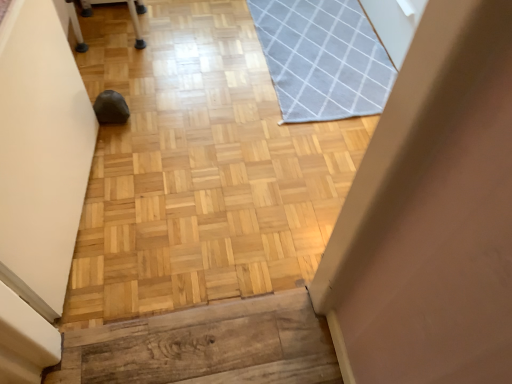
In order to face gray woven mat at upper right, should I rotate leftwards or rightwards?

It's best to rotate right around 9.405 degrees.

Measure the distance between point (265, 23) and camera.

A distance of 2.27 meters exists between point (265, 23) and camera.

Find the location of `gray woven mat at upper right`. gray woven mat at upper right is located at coordinates (322, 58).

What do you see at coordinates (322, 58) in the screenshot? This screenshot has width=512, height=384. I see `gray woven mat at upper right` at bounding box center [322, 58].

Identify the location of matte white plastic chair at upper left. (137, 20).

The height and width of the screenshot is (384, 512). Describe the element at coordinates (137, 20) in the screenshot. I see `matte white plastic chair at upper left` at that location.

You are a GUI agent. You are given a task and a screenshot of the screen. Output one action in this format:
    pyautogui.click(x=<x>, y=<y>)
    Task: Click on the gray woven mat at upper right
    This screenshot has height=384, width=512.
    Given the screenshot: What is the action you would take?
    pyautogui.click(x=322, y=58)

In the image, is matte white plastic chair at upper left on the left side or the right side of gray woven mat at upper right?

From the image, it's evident that matte white plastic chair at upper left is to the left of gray woven mat at upper right.

Considering their positions, is matte white plastic chair at upper left located in front of or behind gray woven mat at upper right?

matte white plastic chair at upper left is behind gray woven mat at upper right.

Which is in front, point (138, 44) or point (271, 36)?

Point (138, 44)

From the picture: From the image's perspective, is matte white plastic chair at upper left positioned above or below gray woven mat at upper right?

From the image's perspective, matte white plastic chair at upper left appears above gray woven mat at upper right.

From a real-world perspective, is matte white plastic chair at upper left physically located above or below gray woven mat at upper right?

From a real-world perspective, matte white plastic chair at upper left is physically above gray woven mat at upper right.

Is matte white plastic chair at upper left wider or thinner than gray woven mat at upper right?

Considering their sizes, matte white plastic chair at upper left looks slimmer than gray woven mat at upper right.

Considering the sizes of matte white plastic chair at upper left and gray woven mat at upper right in the image, is matte white plastic chair at upper left taller or shorter than gray woven mat at upper right?

Clearly, matte white plastic chair at upper left is taller compared to gray woven mat at upper right.

Based on their sizes in the image, would you say matte white plastic chair at upper left is bigger or smaller than gray woven mat at upper right?

Considering their sizes, matte white plastic chair at upper left takes up more space than gray woven mat at upper right.

Is matte white plastic chair at upper left inside the boundaries of gray woven mat at upper right, or outside?

The correct answer is: outside.

Is matte white plastic chair at upper left not close to gray woven mat at upper right?

No, matte white plastic chair at upper left is in close proximity to gray woven mat at upper right.

Is matte white plastic chair at upper left aimed at gray woven mat at upper right?

Yes, matte white plastic chair at upper left is aimed at gray woven mat at upper right.

At what (x,y) coordinates should I click in order to perform the action: click on mat lying in front of the matte white plastic chair at upper left. Please return your answer as a coordinate pair (x, y). The height and width of the screenshot is (384, 512). Looking at the image, I should click on (322, 58).

Is gray woven mat at upper right to the left of matte white plastic chair at upper left from the viewer's perspective?

No.

Is gray woven mat at upper right closer to camera compared to matte white plastic chair at upper left?

Yes, gray woven mat at upper right is closer to the camera.

Is point (378, 108) in front of point (111, 1)?

Yes, it is in front of point (111, 1).

From the image's perspective, is gray woven mat at upper right above matte white plastic chair at upper left?

No, from the image's perspective, gray woven mat at upper right is not over matte white plastic chair at upper left.

From a real-world perspective, is gray woven mat at upper right positioned over matte white plastic chair at upper left based on gravity?

No, from a real-world perspective, gray woven mat at upper right is not above matte white plastic chair at upper left.

Considering the relative sizes of gray woven mat at upper right and matte white plastic chair at upper left in the image provided, is gray woven mat at upper right wider than matte white plastic chair at upper left?

Indeed, gray woven mat at upper right has a greater width compared to matte white plastic chair at upper left.

Does gray woven mat at upper right have a greater height compared to matte white plastic chair at upper left?

In fact, gray woven mat at upper right may be shorter than matte white plastic chair at upper left.

Does gray woven mat at upper right have a larger size compared to matte white plastic chair at upper left?

No, gray woven mat at upper right is not bigger than matte white plastic chair at upper left.

Is gray woven mat at upper right surrounding matte white plastic chair at upper left?

No, gray woven mat at upper right does not contain matte white plastic chair at upper left.

Is gray woven mat at upper right next to matte white plastic chair at upper left?

No, gray woven mat at upper right is not beside matte white plastic chair at upper left.

Is gray woven mat at upper right looking in the opposite direction of matte white plastic chair at upper left?

gray woven mat at upper right is not turned away from matte white plastic chair at upper left.

Can you tell me how much gray woven mat at upper right and matte white plastic chair at upper left differ in facing direction?

The facing directions of gray woven mat at upper right and matte white plastic chair at upper left are 179 degrees apart.

How distant is gray woven mat at upper right from matte white plastic chair at upper left?

gray woven mat at upper right is 88.25 centimeters from matte white plastic chair at upper left.

Identify the location of mat in front of the matte white plastic chair at upper left. (322, 58).

This screenshot has width=512, height=384. What are the coordinates of `furniture behind the gray woven mat at upper right` in the screenshot? It's located at (137, 20).

Where is `mat that is in front of the matte white plastic chair at upper left`? mat that is in front of the matte white plastic chair at upper left is located at coordinates (322, 58).